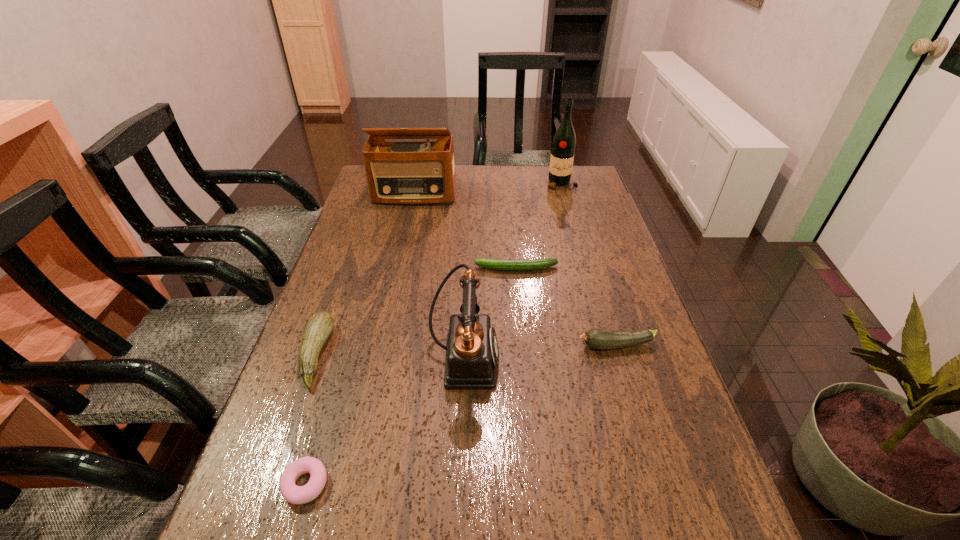
Find the location of a particular element. wine bottle is located at coordinates (563, 145).

Identify the location of radio receiver. The image size is (960, 540). (398, 172).

The height and width of the screenshot is (540, 960). Find the location of `telephone`. telephone is located at coordinates (472, 353).

I want to click on the fourth shortest object, so click(321, 324).

This screenshot has width=960, height=540. I want to click on the tallest zucchini, so click(x=321, y=324).

Identify the location of the second tallest zucchini. (602, 339).

At what (x,y) coordinates should I click in order to perform the action: click on the fifth tallest object. Please return your answer as a coordinate pair (x, y). The image size is (960, 540). Looking at the image, I should click on (602, 339).

The width and height of the screenshot is (960, 540). I want to click on the farthest zucchini, so click(x=498, y=264).

Find the location of `the third farthest object`. the third farthest object is located at coordinates (498, 264).

Locate an element on the screen. This screenshot has width=960, height=540. pastry is located at coordinates point(294,494).